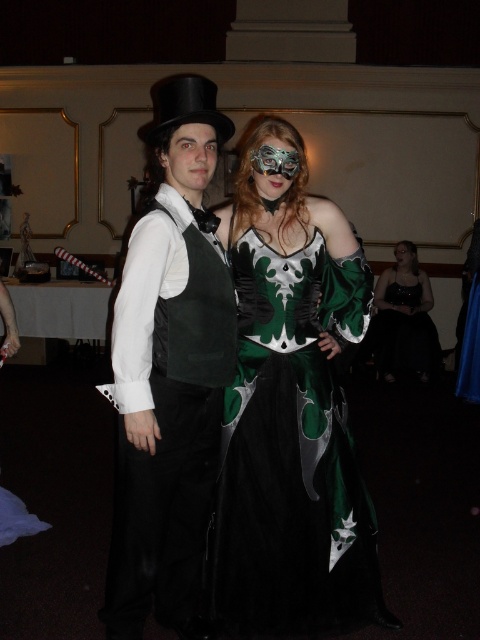
Question: Among these points, which one is farthest from the camera?

Choices:
 (A) (141, 250)
 (B) (257, 166)
 (C) (261, 294)
 (D) (205, 180)

Answer: (C)

Question: Does matte black face at center appear under matte black mask at center?

Choices:
 (A) no
 (B) yes

Answer: (B)

Question: Which object is the closest to the matte black face at center?

Choices:
 (A) metallic mask at center
 (B) black satin dress at lower right
 (C) matte black mask at center

Answer: (A)

Question: Which object is the closest to the suede black vest at center?

Choices:
 (A) matte black mask at center
 (B) metallic mask at center
 (C) black satin dress at lower right

Answer: (B)

Question: Is black satin dress at lower right positioned at the back of matte black mask at center?

Choices:
 (A) no
 (B) yes

Answer: (A)

Question: Does green satin dress at center lie behind black satin dress at lower right?

Choices:
 (A) no
 (B) yes

Answer: (A)